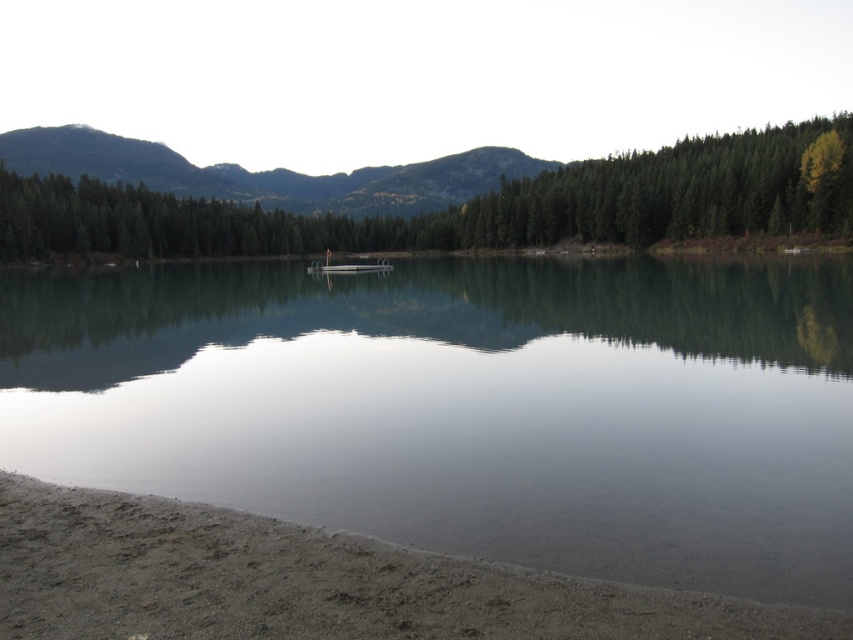
Question: Is green reflective water at center positioned in front of sandy shore at lower left?

Choices:
 (A) yes
 (B) no

Answer: (B)

Question: Which of the following is the closest to the observer?

Choices:
 (A) pos(332,266)
 (B) pos(764,346)
 (C) pos(553,205)
 (D) pos(468,625)

Answer: (D)

Question: Is green reflective water at center below metallic silver boat at center?

Choices:
 (A) no
 (B) yes

Answer: (B)

Question: Among these objects, which one is nearest to the camera?

Choices:
 (A) green forested mountain at upper left
 (B) green reflective water at center
 (C) sandy shore at lower left

Answer: (C)

Question: Does green reflective water at center appear under metallic silver boat at center?

Choices:
 (A) no
 (B) yes

Answer: (B)

Question: Considering the real-world distances, which object is farthest from the sandy shore at lower left?

Choices:
 (A) green matte trees at upper center
 (B) green forested mountain at upper left
 (C) green reflective water at center
 (D) metallic silver boat at center

Answer: (B)